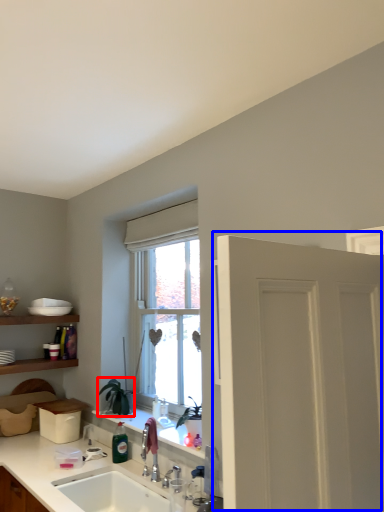
Question: Which object is further to the camera taking this photo, plant (highlighted by a red box) or door (highlighted by a blue box)?

Choices:
 (A) plant
 (B) door

Answer: (A)